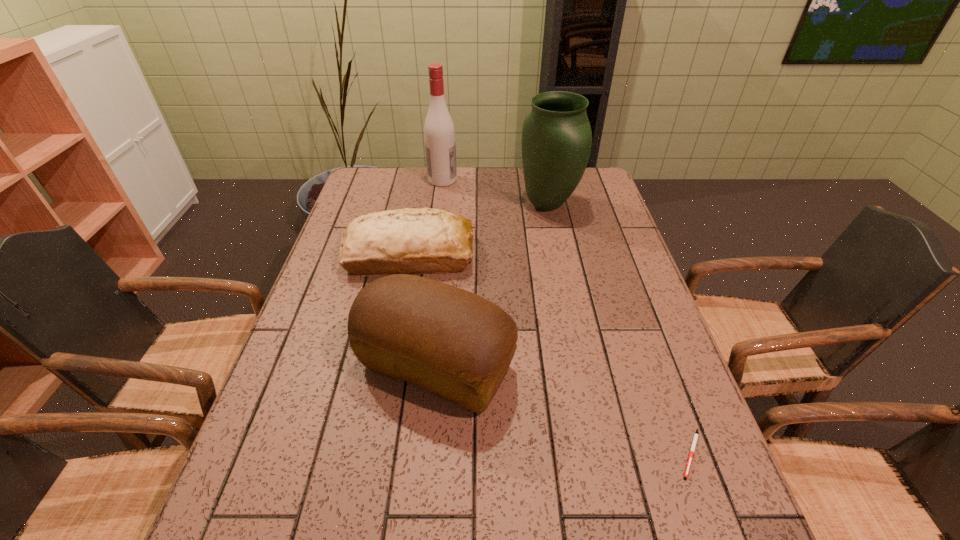
You are a GUI agent. You are given a task and a screenshot of the screen. Output one action in this format:
    pyautogui.click(x=<x>, y=<y>)
    Task: Click on the free space between the alcohol and the vase
    This screenshot has height=540, width=960.
    Given the screenshot: What is the action you would take?
    pyautogui.click(x=495, y=192)

Point out which object is positioned as the nearest to the farther bread. Please provide its 2D coordinates. Your answer should be formatted as a tuple, i.e. [(x, y)], where the tuple contains the x and y coordinates of a point satisfying the conditions above.

[(454, 343)]

Where is `object that is the third closest to the fourth object from left to right`? This screenshot has height=540, width=960. object that is the third closest to the fourth object from left to right is located at coordinates (454, 343).

You are a GUI agent. You are given a task and a screenshot of the screen. Output one action in this format:
    pyautogui.click(x=<x>, y=<y>)
    Task: Click on the blank space that satisfies the following two spatial constraints: 1. on the label of the second nearest object; 2. on the left side of the alcohol
    The width and height of the screenshot is (960, 540).
    Given the screenshot: What is the action you would take?
    pyautogui.click(x=420, y=367)

Identify the location of vacant space that satisfies the following two spatial constraints: 1. on the label of the alcohol; 2. on the front side of the third farthest object. The image size is (960, 540). (433, 255).